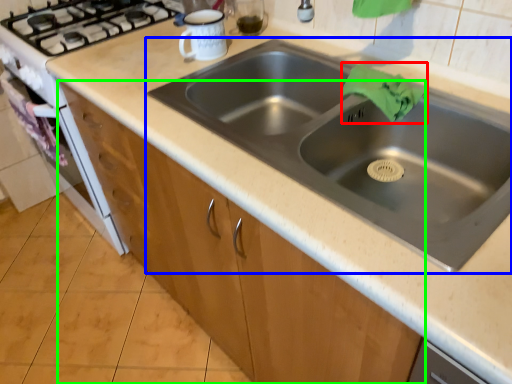
Question: Estimate the real-world distances between objects in this image. Which object is closer to cloth (highlighted by a red box), sink (highlighted by a blue box) or cabinetry (highlighted by a green box)?

Choices:
 (A) sink
 (B) cabinetry

Answer: (A)